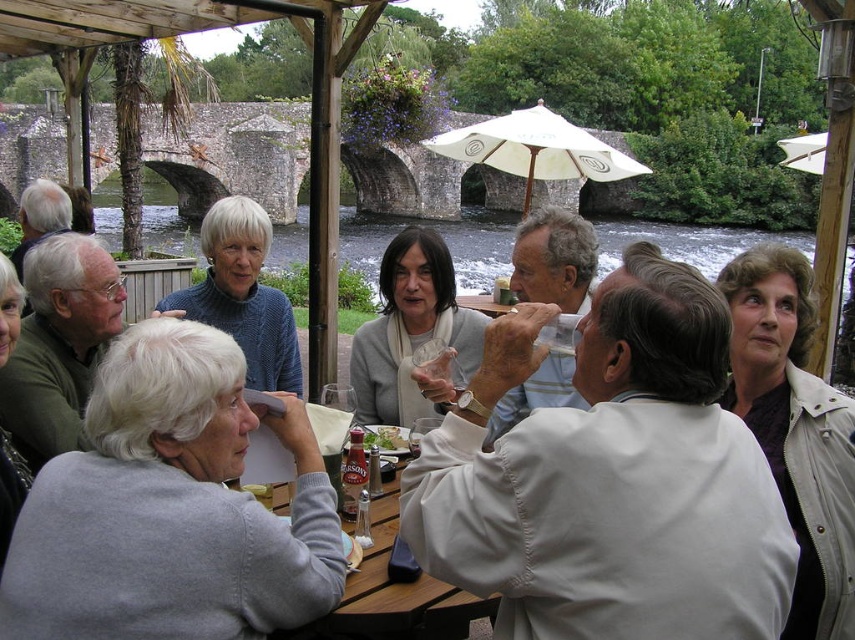
You are a photographer at the riverside gathering. You need to take a photo of both the light beige jacket at upper right and the knitted sweater at upper center. Which object should you focus on first if you want to capture both in the frame without moving the camera?

You should focus on the light beige jacket at upper right first because it is larger in size than the knitted sweater at upper center, making it easier to ensure it fits within the frame while still capturing the smaller knitted sweater at upper center.

You are standing at the wooden table at center. A friend is standing on the stone bridge in the background. How far apart are you and your friend?

The distance between you and your friend is 24.11 meters.

You are a photographer trying to capture a closeup of the matte gray sweater at center and the white fabric umbrella at center. Since you want to focus on the details of the sweater, which object should you zoom in on first?

The matte gray sweater at center is smaller in width than the white fabric umbrella at center, so you should zoom in on the matte gray sweater at center first to ensure its details are captured clearly before adjusting for the larger umbrella.